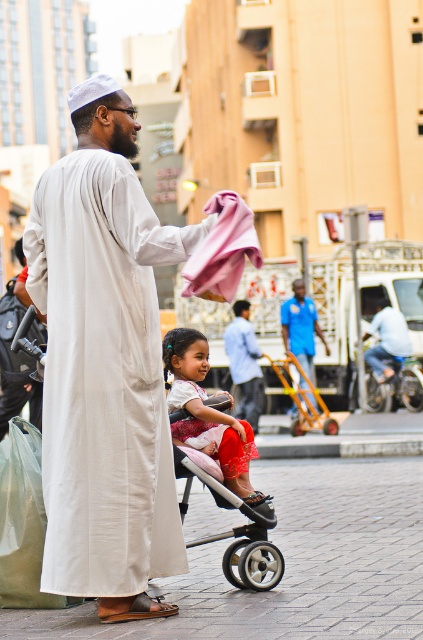
Is silver metallic stroller at center to the right of light blue shirt at center from the viewer's perspective?

In fact, silver metallic stroller at center is to the left of light blue shirt at center.

Where is `silver metallic stroller at center`? The width and height of the screenshot is (423, 640). silver metallic stroller at center is located at coordinates (247, 545).

Where is `silver metallic stroller at center`? The width and height of the screenshot is (423, 640). silver metallic stroller at center is located at coordinates (247, 545).

Who is more distant from viewer, [49,376] or [260,388]?

The point [260,388] is behind.

Is matte white robe at center shorter than matte beige robe at center?

Yes, matte white robe at center is shorter than matte beige robe at center.

Which is in front, point (49, 433) or point (252, 412)?

Positioned in front is point (49, 433).

This screenshot has width=423, height=640. Find the location of `matte white robe at center`. matte white robe at center is located at coordinates (104, 364).

Between matte white robe at center and silver metallic stroller at center, which one appears on the left side from the viewer's perspective?

From the viewer's perspective, matte white robe at center appears more on the left side.

Is point (170, 236) behind point (263, 589)?

That is False.

This screenshot has height=640, width=423. I want to click on matte white robe at center, so click(104, 364).